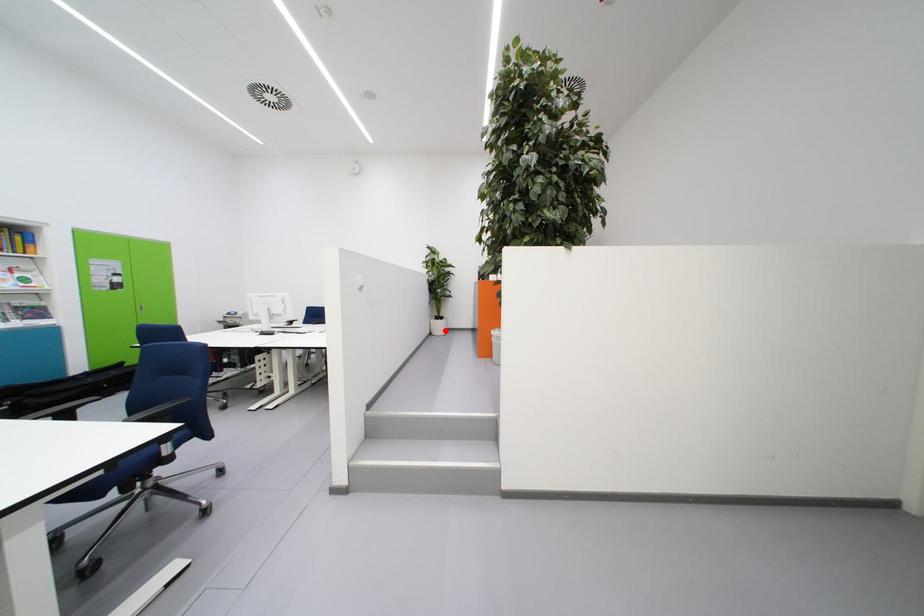
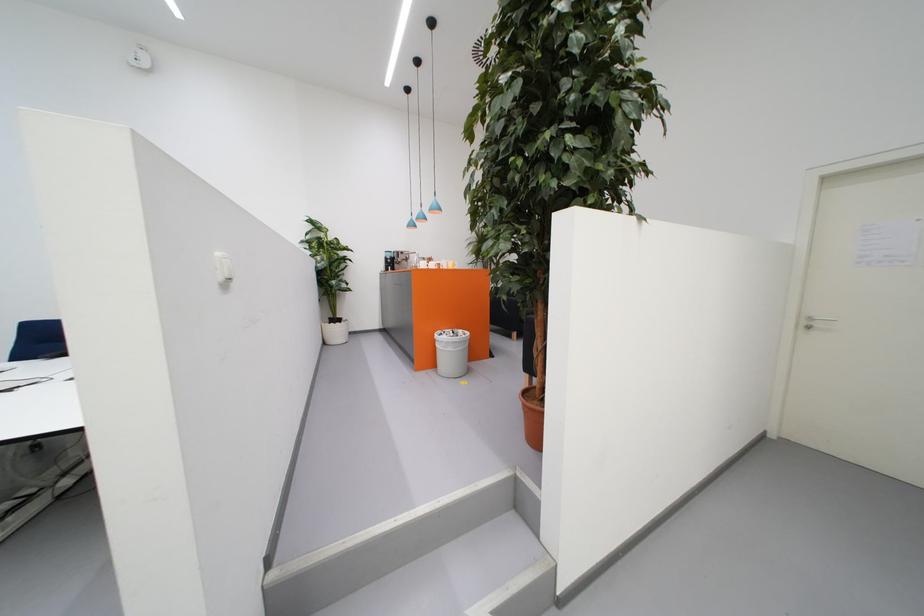
Question: I am providing you with two images of the same scene from different viewpoints. Given a red point in image1, look at the same physical point in image2. Is it:

Choices:
 (A) Closer to the viewpoint
 (B) Farther from the viewpoint

Answer: (B)